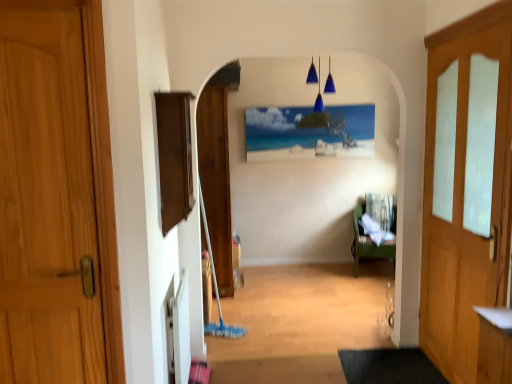
Locate an element on the screen. This screenshot has width=512, height=384. vacant space that is to the left of green wicker chair at center-right is located at coordinates (335, 272).